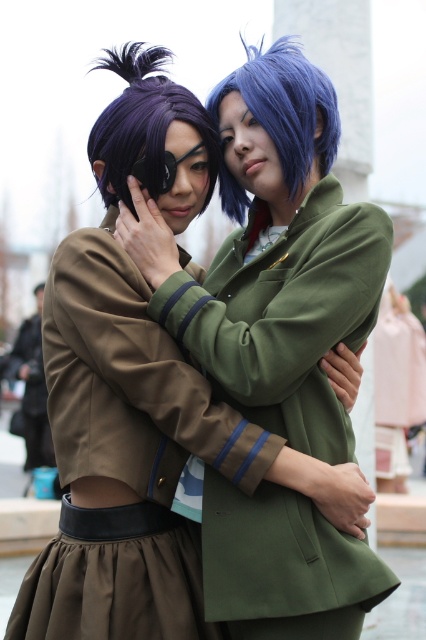
You are a photographer trying to capture a clear photo of the matte brown dress at center and the blue matte wig at upper center. Which object will appear smaller in the photo?

The matte brown dress at center will appear smaller in the photo because it has a lesser height compared to the blue matte wig at upper center.

You are a photographer setting up a shoot for a magazine. You need to ensure that the matte brown dress at center and the purple matte wig at upper left are both visible in the frame. Based on their positions, which object is closer to the camera?

The purple matte wig at upper left is closer to the camera because the matte brown dress at center is positioned under it, indicating it is behind.